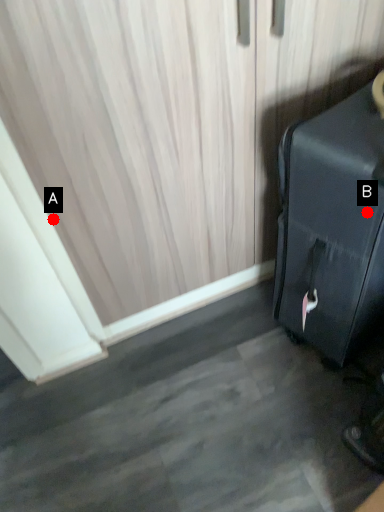
Question: Two points are circled on the image, labeled by A and B beside each circle. Which of the following is the farthest from the observer?

Choices:
 (A) A is further
 (B) B is further

Answer: (A)